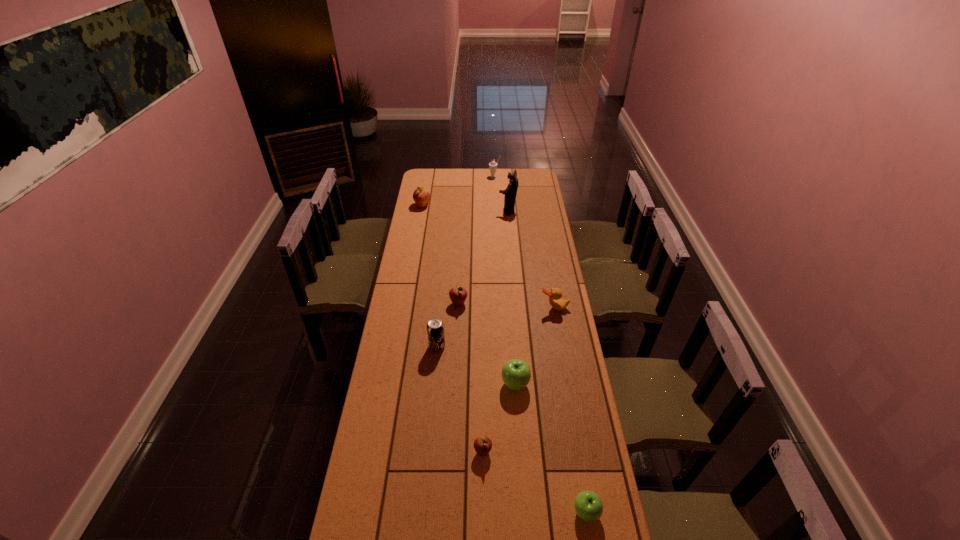
Locate an element on the screen. The width and height of the screenshot is (960, 540). vacant space in between the second apple from left to right and the second nearest apple is located at coordinates (470, 377).

The width and height of the screenshot is (960, 540). I want to click on empty space that is in between the duck and the second object from left to right, so click(495, 327).

At what (x,y) coordinates should I click in order to perform the action: click on blank region between the soda can and the tallest object. Please return your answer as a coordinate pair (x, y). Looking at the image, I should click on (472, 279).

Find the location of `empty space that is in between the smallest red apple and the farthest object`. empty space that is in between the smallest red apple and the farthest object is located at coordinates (489, 315).

Identify which object is located as the seventh nearest to the figurine. Please provide its 2D coordinates. Your answer should be formatted as a tuple, i.e. [(x, y)], where the tuple contains the x and y coordinates of a point satisfying the conditions above.

[(482, 445)]

Find the location of a particular element. This screenshot has height=540, width=960. the fourth closest object to the fourth apple from left to right is located at coordinates (458, 295).

The image size is (960, 540). In order to click on apple that is the closest to the milkshake in this screenshot , I will do `click(421, 196)`.

Identify the location of apple that is the fourth closest to the milkshake. (482, 445).

Identify which red apple is the nearest to the leftmost apple. Please provide its 2D coordinates. Your answer should be formatted as a tuple, i.e. [(x, y)], where the tuple contains the x and y coordinates of a point satisfying the conditions above.

[(458, 295)]

Where is `the second closest red apple to the figurine`? Image resolution: width=960 pixels, height=540 pixels. the second closest red apple to the figurine is located at coordinates click(458, 295).